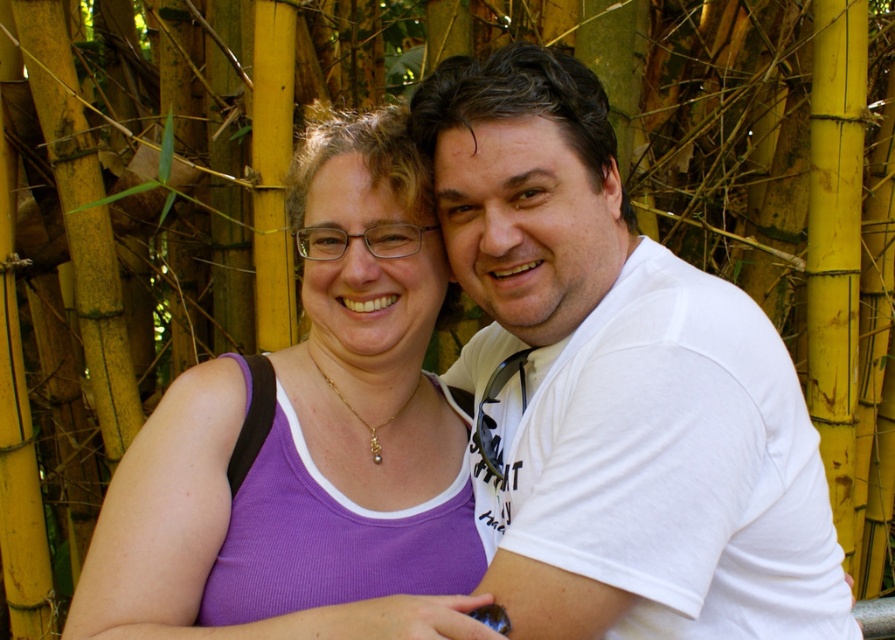
Question: Which point is closer to the camera taking this photo?

Choices:
 (A) (365, 240)
 (B) (776, 468)

Answer: (B)

Question: Which point is closer to the camera?

Choices:
 (A) (168, 531)
 (B) (480, 106)

Answer: (A)

Question: Can you confirm if white cotton shirt at center is positioned below purple fabric tank top at center?

Choices:
 (A) yes
 (B) no

Answer: (A)

Question: Can you confirm if white cotton shirt at center is positioned below purple fabric tank top at center?

Choices:
 (A) yes
 (B) no

Answer: (A)

Question: Is white cotton shirt at center smaller than purple fabric tank top at center?

Choices:
 (A) no
 (B) yes

Answer: (A)